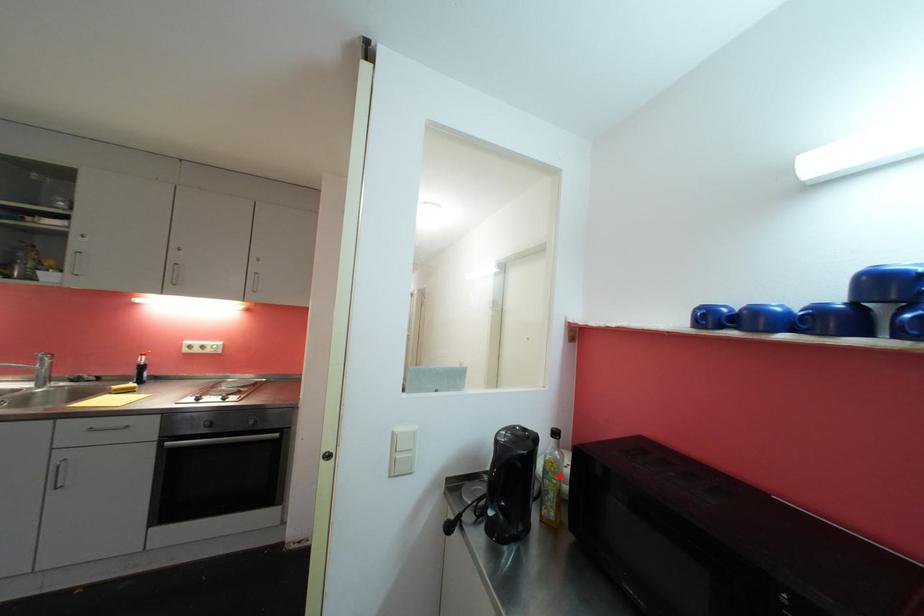
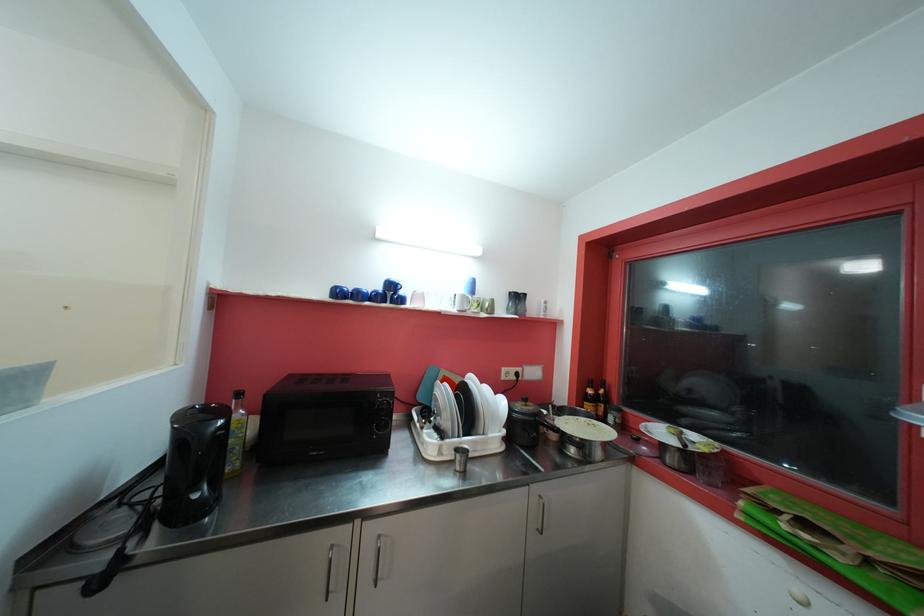
The point at the highlighted location is marked in the first image. Where is the corresponding point in the second image?

(247, 430)